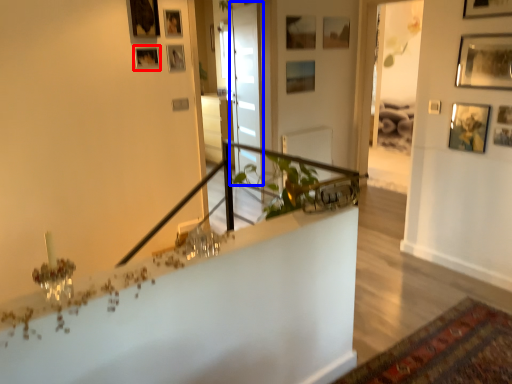
Question: Which of the following is the closest to the observer, picture frame (highlighted by a red box) or glass door (highlighted by a blue box)?

Choices:
 (A) picture frame
 (B) glass door

Answer: (A)